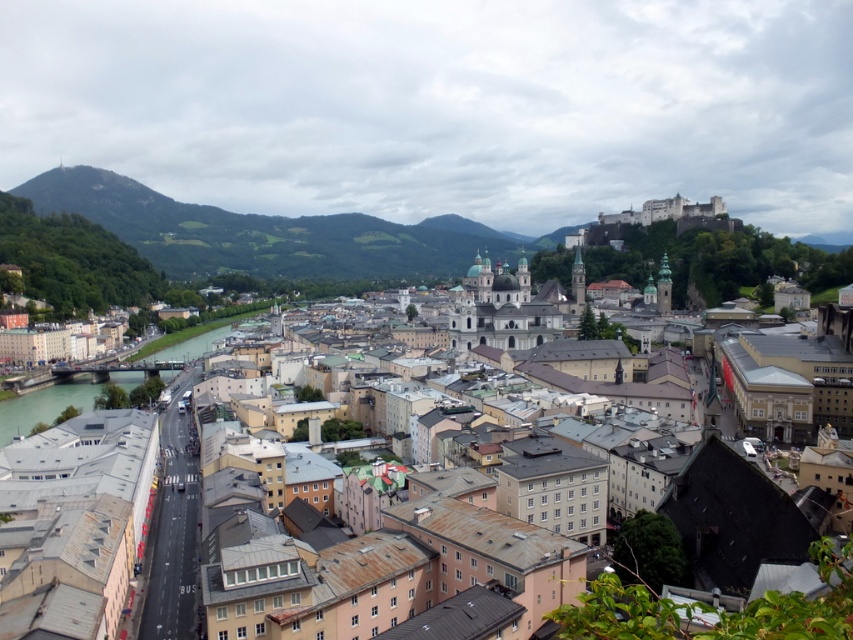
You are standing in the historic city and want to take a photo of both point (675, 630) and point (260, 236) in the same frame. Based on their positions, which point will appear larger in your photo?

Point (675, 630) is closer to the camera than point (260, 236), so it will appear larger in the photo.